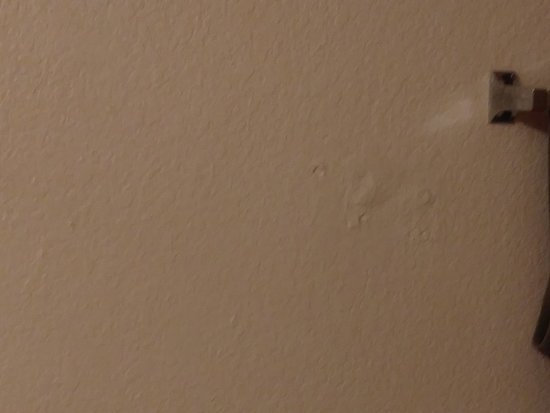
In order to click on left side of towel rack mount in this screenshot , I will do `click(503, 101)`.